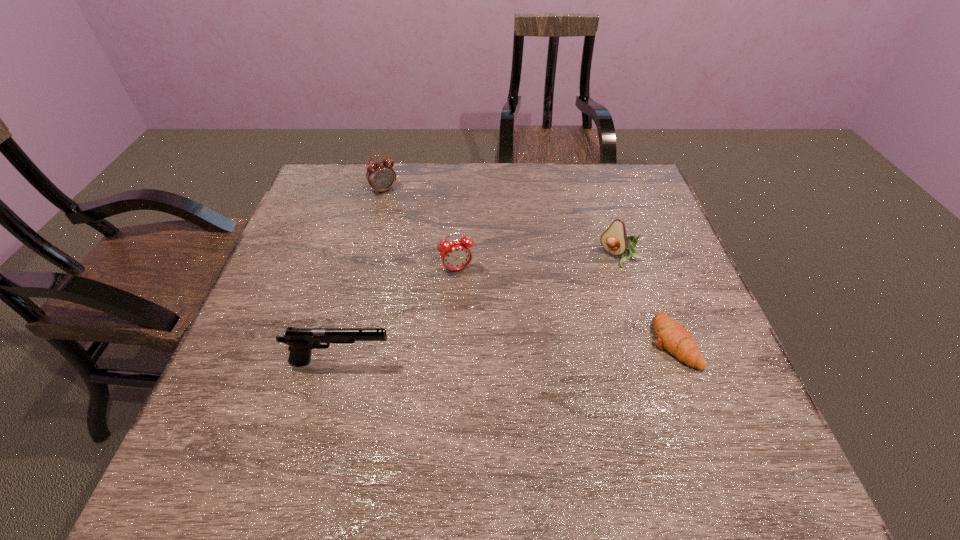
Find the location of `free space on the desktop that is between the gun and the crescent roll and is positioned on the face of the farthest object`. free space on the desktop that is between the gun and the crescent roll and is positioned on the face of the farthest object is located at coordinates (498, 353).

At what (x,y) coordinates should I click in order to perform the action: click on free space on the desktop that is between the gun and the crescent roll and is positioned on the seed side of the avocado. Please return your answer as a coordinate pair (x, y). The width and height of the screenshot is (960, 540). Looking at the image, I should click on (533, 350).

The image size is (960, 540). What are the coordinates of `vacant space on the desktop that is between the gun and the crescent roll and is positioned on the face of the nearer alarm clock` in the screenshot? It's located at (489, 353).